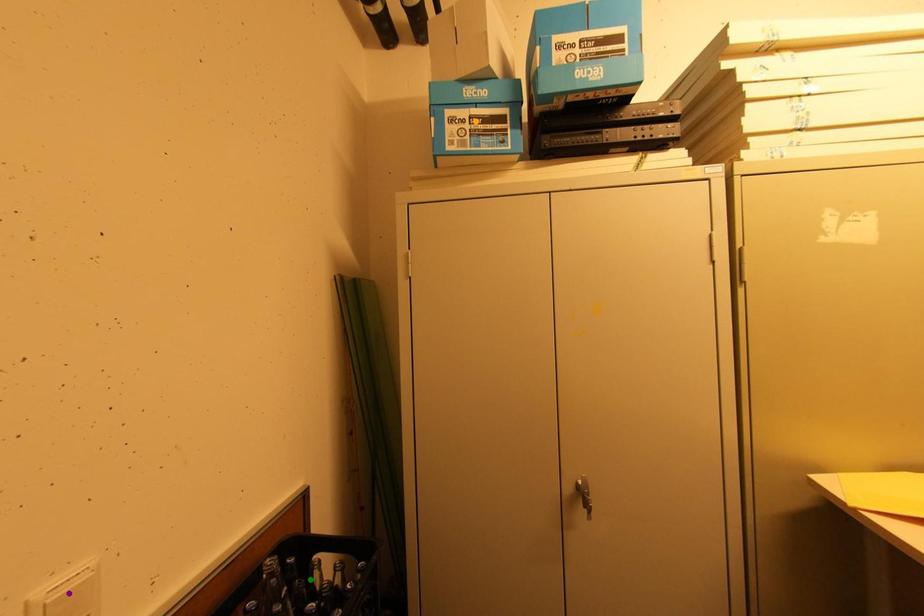
Order these from nearest to farthest:
green point, orange point, purple point

purple point, green point, orange point